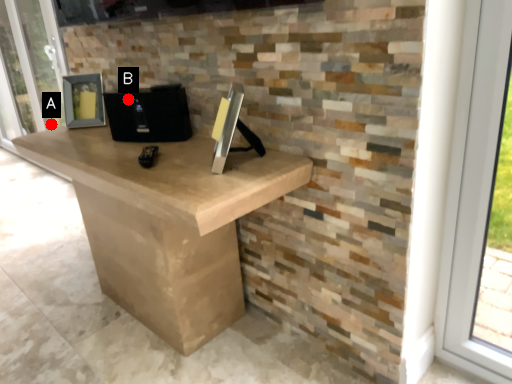
Question: Two points are circled on the image, labeled by A and B beside each circle. Which point is closer to the camera?

Choices:
 (A) A is closer
 (B) B is closer

Answer: (B)